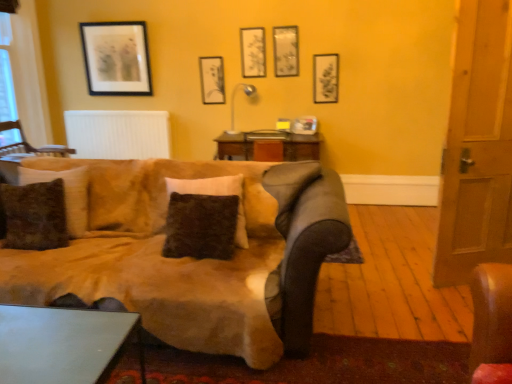
Question: Considering the relative sizes of matte black picture frame at upper center, the 3th picture frame viewed from the right, and matte black picture frame at upper center, which ranks as the second picture frame in left-to-right order, in the image provided, is matte black picture frame at upper center, the 3th picture frame viewed from the right, smaller than matte black picture frame at upper center, which ranks as the second picture frame in left-to-right order,?

Choices:
 (A) yes
 (B) no

Answer: (A)

Question: From the image's perspective, is matte black picture frame at upper center, the 3th picture frame viewed from the right, above matte black picture frame at upper center, marked as the 4th picture frame in a right-to-left arrangement?

Choices:
 (A) yes
 (B) no

Answer: (A)

Question: Considering the relative positions of matte black picture frame at upper center, the 3th picture frame viewed from the right, and matte black picture frame at upper center, which ranks as the second picture frame in left-to-right order, in the image provided, is matte black picture frame at upper center, the 3th picture frame viewed from the right, behind matte black picture frame at upper center, which ranks as the second picture frame in left-to-right order,?

Choices:
 (A) yes
 (B) no

Answer: (B)

Question: Would you say matte black picture frame at upper center, acting as the 3th picture frame starting from the left, contains matte black picture frame at upper center, marked as the 4th picture frame in a right-to-left arrangement?

Choices:
 (A) no
 (B) yes

Answer: (A)

Question: Could you tell me if matte black picture frame at upper center, acting as the 3th picture frame starting from the left, is turned towards matte black picture frame at upper center, marked as the 4th picture frame in a right-to-left arrangement?

Choices:
 (A) yes
 (B) no

Answer: (B)

Question: From a real-world perspective, is matte black picture frame at upper center, marked as the 4th picture frame in a right-to-left arrangement, above or below metallic gray table at lower left?

Choices:
 (A) above
 (B) below

Answer: (A)

Question: From the image's perspective, is matte black picture frame at upper center, which ranks as the second picture frame in left-to-right order, located above or below metallic gray table at lower left?

Choices:
 (A) below
 (B) above

Answer: (B)

Question: In the image, is matte black picture frame at upper center, which ranks as the second picture frame in left-to-right order, on the left side or the right side of metallic gray table at lower left?

Choices:
 (A) left
 (B) right

Answer: (B)

Question: Relative to metallic gray table at lower left, is matte black picture frame at upper center, which ranks as the second picture frame in left-to-right order, in front or behind?

Choices:
 (A) behind
 (B) front

Answer: (A)

Question: In terms of width, does fuzzy brown pillow at center, the first pillow positioned from the right, look wider or thinner when compared to matte black picture frame at upper left, which ranks as the fifth picture frame in right-to-left order?

Choices:
 (A) thin
 (B) wide

Answer: (B)

Question: In terms of height, does fuzzy brown pillow at center, the first pillow positioned from the right, look taller or shorter compared to matte black picture frame at upper left, which ranks as the fifth picture frame in right-to-left order?

Choices:
 (A) short
 (B) tall

Answer: (A)

Question: From a real-world perspective, relative to matte black picture frame at upper left, which ranks as the fifth picture frame in right-to-left order, is fuzzy brown pillow at center, the first pillow positioned from the right, vertically above or below?

Choices:
 (A) below
 (B) above

Answer: (A)

Question: Is fuzzy brown pillow at center, which is counted as the second pillow, starting from the left, situated inside matte black picture frame at upper left, which ranks as the fifth picture frame in right-to-left order, or outside?

Choices:
 (A) outside
 (B) inside

Answer: (A)

Question: Considering the relative positions of wooden door at right and wooden chair at left in the image provided, is wooden door at right to the left or to the right of wooden chair at left?

Choices:
 (A) right
 (B) left

Answer: (A)

Question: From a real-world perspective, is wooden door at right physically located above or below wooden chair at left?

Choices:
 (A) above
 (B) below

Answer: (A)